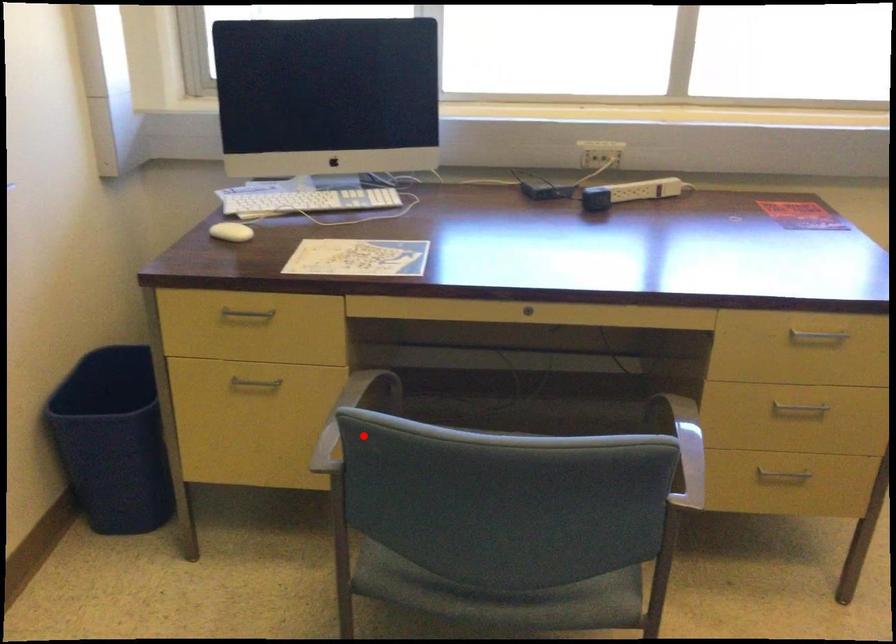
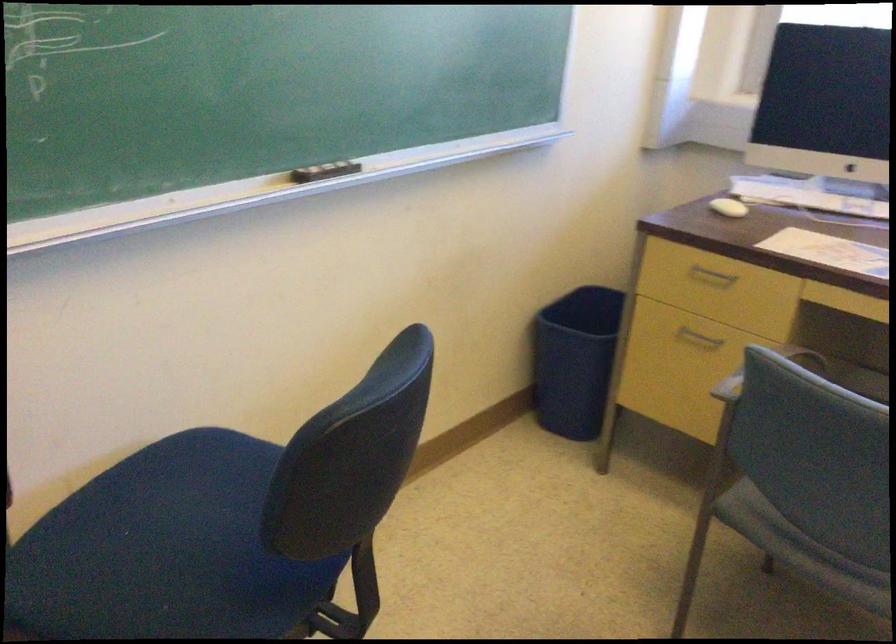
Question: I am providing you with two images of the same scene from different viewpoints. Given a red point in image1, look at the same physical point in image2. Is it:

Choices:
 (A) Closer to the viewpoint
 (B) Farther from the viewpoint

Answer: (B)